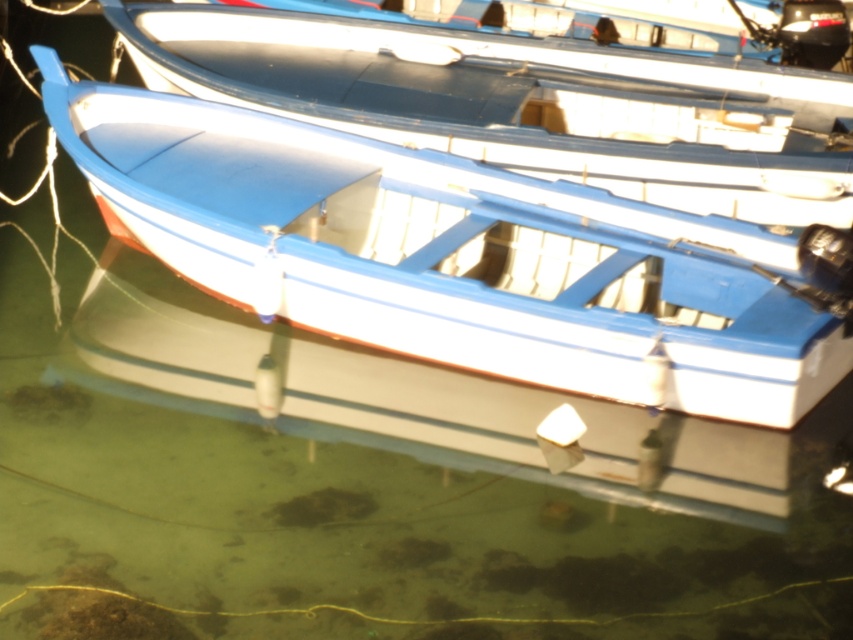
You are a photographer taking a picture of the boat. You notice two points marked on the boat. Which point, point (225,280) or point (608,86), appears larger in your photo?

Point (225,280) appears larger in the photo because it is closer to the camera than point (608,86).

You are navigating a small blue and white boat with a black outboard motor at the rear. There is also a matte blue canoe at center. Based on their positions, which object is closer to the viewer?

The matte blue canoe at center is closer to the viewer because it is located at point (456, 257), which is closer than the boat with the black outboard motor at the rear.

You are standing on the dock and see two boats in the water. The first is a matte blue canoe at center, and the second is a blue matte boat at center. Which boat is closer to you?

The matte blue canoe at center is closer to you because it is in front of the blue matte boat at center.